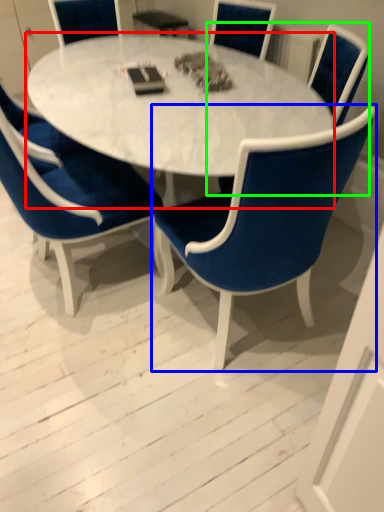
Question: Estimate the real-world distances between objects in this image. Which object is farther from coffee table (highlighted by a red box), chair (highlighted by a blue box) or chair (highlighted by a green box)?

Choices:
 (A) chair
 (B) chair

Answer: (B)